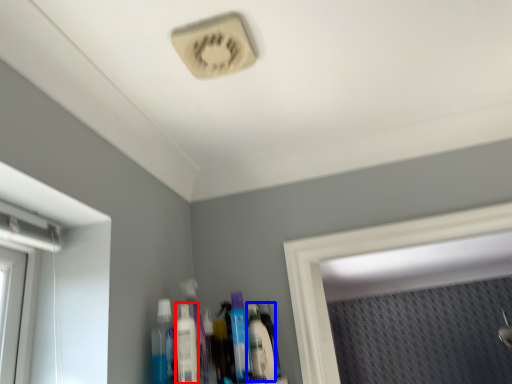
Question: Among these objects, which one is nearest to the camera, mouthwash (highlighted by a red box) or mouthwash (highlighted by a blue box)?

Choices:
 (A) mouthwash
 (B) mouthwash

Answer: (A)